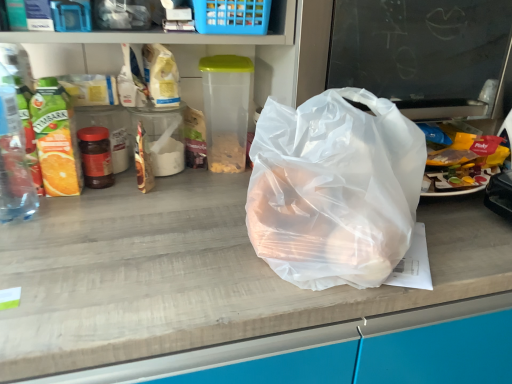
Question: Is transparent plastic bag at center in contact with transparent plastic bag at center?

Choices:
 (A) no
 (B) yes

Answer: (A)

Question: Does transparent plastic bag at center appear on the right side of transparent plastic bag at center?

Choices:
 (A) yes
 (B) no

Answer: (B)

Question: Is transparent plastic bag at center thinner than transparent plastic bag at center?

Choices:
 (A) no
 (B) yes

Answer: (B)

Question: Does transparent plastic bag at center have a larger size compared to transparent plastic bag at center?

Choices:
 (A) no
 (B) yes

Answer: (A)

Question: Is transparent plastic bag at center inside transparent plastic bag at center?

Choices:
 (A) yes
 (B) no

Answer: (B)

Question: Is clear plastic bottle at left wider or thinner than transparent plastic bag at center?

Choices:
 (A) thin
 (B) wide

Answer: (A)

Question: Considering the positions of point (27, 180) and point (464, 21), is point (27, 180) closer or farther from the camera than point (464, 21)?

Choices:
 (A) closer
 (B) farther

Answer: (A)

Question: In the image, is clear plastic bottle at left positioned in front of or behind transparent plastic bag at center?

Choices:
 (A) behind
 (B) front

Answer: (B)

Question: From a real-world perspective, relative to transparent plastic bag at center, is clear plastic bottle at left vertically above or below?

Choices:
 (A) above
 (B) below

Answer: (B)

Question: Visually, is transparent plastic bag at center positioned to the left or to the right of clear plastic bottle at left?

Choices:
 (A) right
 (B) left

Answer: (A)

Question: Is transparent plastic bag at center bigger or smaller than clear plastic bottle at left?

Choices:
 (A) big
 (B) small

Answer: (A)

Question: Is point (457, 61) closer or farther from the camera than point (18, 180)?

Choices:
 (A) farther
 (B) closer

Answer: (A)

Question: From the image's perspective, is transparent plastic bag at center located above or below clear plastic bottle at left?

Choices:
 (A) below
 (B) above

Answer: (B)

Question: From their relative heights in the image, would you say transparent plastic bag at center is taller or shorter than blue plastic basket at upper center?

Choices:
 (A) short
 (B) tall

Answer: (B)

Question: In terms of size, does transparent plastic bag at center appear bigger or smaller than blue plastic basket at upper center?

Choices:
 (A) big
 (B) small

Answer: (A)